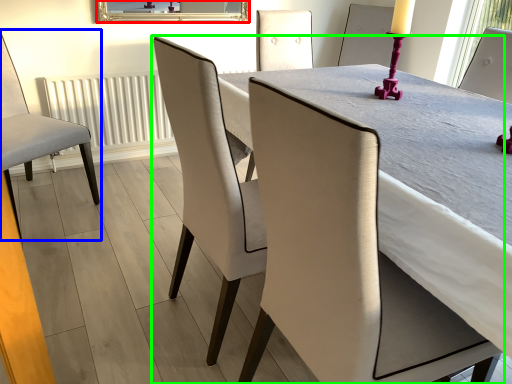
Question: Which object is the closest to the mirror (highlighted by a red box)? Choose among these: chair (highlighted by a blue box) or chair (highlighted by a green box).

Choices:
 (A) chair
 (B) chair

Answer: (A)